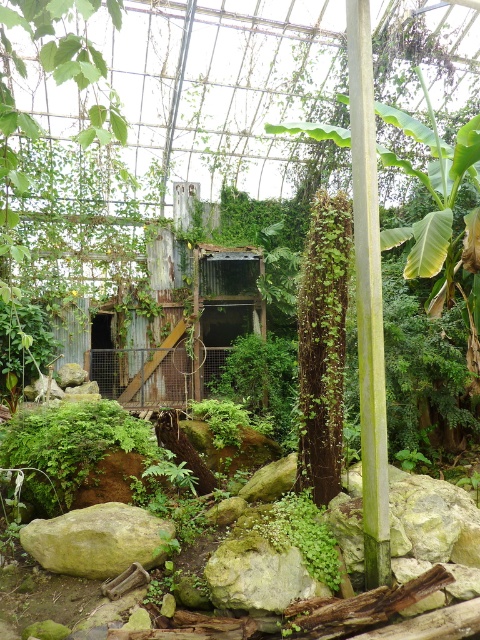
Is green mossy rock at center to the left of green mossy rock at lower left from the viewer's perspective?

Correct, you'll find green mossy rock at center to the left of green mossy rock at lower left.

Is point (3, 438) behind point (81, 522)?

That is True.

This screenshot has height=640, width=480. Find the location of `green mossy rock at center`. green mossy rock at center is located at coordinates (71, 445).